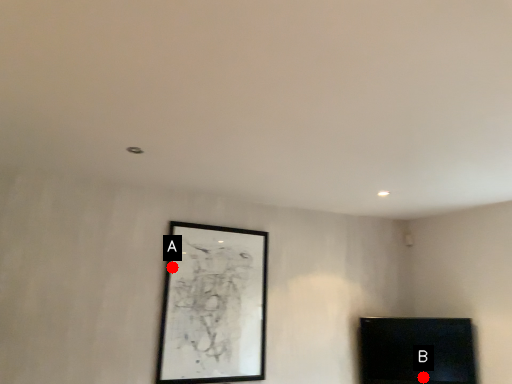
Question: Two points are circled on the image, labeled by A and B beside each circle. Which point appears closest to the camera in this image?

Choices:
 (A) A is closer
 (B) B is closer

Answer: (A)